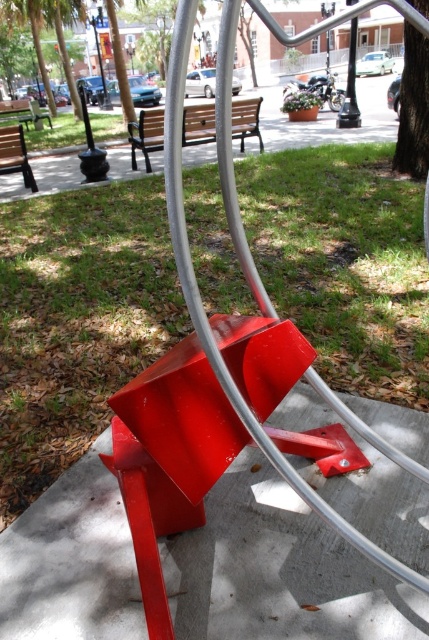
Who is higher up, matte wood bench at upper center or metallic pole at upper center?

metallic pole at upper center

Does matte wood bench at upper center have a lesser width compared to metallic pole at upper center?

No, matte wood bench at upper center is not thinner than metallic pole at upper center.

The height and width of the screenshot is (640, 429). Describe the element at coordinates (329, 120) in the screenshot. I see `matte wood bench at upper center` at that location.

The height and width of the screenshot is (640, 429). Find the location of `matte wood bench at upper center`. matte wood bench at upper center is located at coordinates pos(329,120).

Between point (365, 620) and point (17, 163), which one is positioned in front?

Point (365, 620)

Does point (283, 602) come in front of point (5, 164)?

Yes, point (283, 602) is closer to viewer.

Which is behind, point (94, 620) or point (29, 186)?

Positioned behind is point (29, 186).

This screenshot has height=640, width=429. Find the location of `glossy metal bench at center`. glossy metal bench at center is located at coordinates (278, 570).

Is wooden bench at upper center to the right of metallic pole at upper center from the viewer's perspective?

No, wooden bench at upper center is not to the right of metallic pole at upper center.

In the scene shown: Who is more distant from viewer, (x=145, y=168) or (x=355, y=93)?

Positioned behind is point (x=355, y=93).

Between point (256, 118) and point (347, 76), which one is positioned in front?

Positioned in front is point (256, 118).

Find the location of a particular element. The height and width of the screenshot is (640, 429). wooden bench at upper center is located at coordinates 147,134.